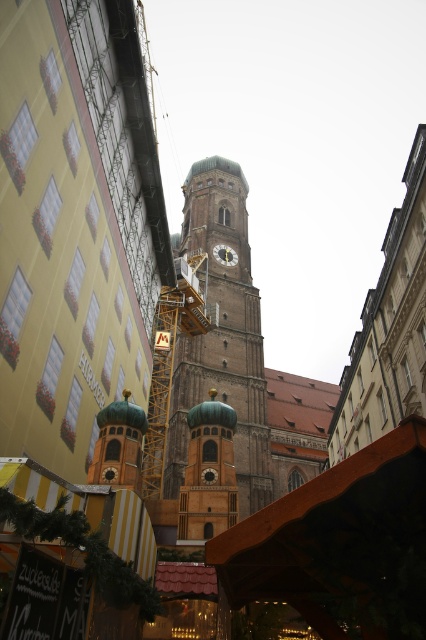
Measure the distance between brown stone tower at center and gold domed bell tower at center.

brown stone tower at center is 42.78 meters from gold domed bell tower at center.

Who is more forward, (x=207, y=376) or (x=222, y=410)?

Point (x=222, y=410) is in front.

What do you see at coordinates (221, 333) in the screenshot?
I see `brown stone tower at center` at bounding box center [221, 333].

Locate an element on the screen. This screenshot has width=426, height=640. brown stone tower at center is located at coordinates (221, 333).

Can you confirm if brown stone tower at center is bigger than gold metallic clock at center?

Correct, brown stone tower at center is larger in size than gold metallic clock at center.

Is point (219, 195) positioned in front of point (230, 252)?

No, (219, 195) is further to viewer.

Where is `brown stone tower at center`? This screenshot has width=426, height=640. brown stone tower at center is located at coordinates (221, 333).

Which of these two, gold domed bell tower at center or gold metallic clock at center, stands taller?

Standing taller between the two is gold domed bell tower at center.

Between gold domed bell tower at center and gold metallic clock at center, which one has less height?

Standing shorter between the two is gold metallic clock at center.

At what (x,y) coordinates should I click in order to perform the action: click on gold domed bell tower at center. Please return your answer as a coordinate pair (x, y). Looking at the image, I should click on (207, 474).

At what (x,y) coordinates should I click in order to perform the action: click on gold domed bell tower at center. Please return your answer as a coordinate pair (x, y). The width and height of the screenshot is (426, 640). Looking at the image, I should click on (207, 474).